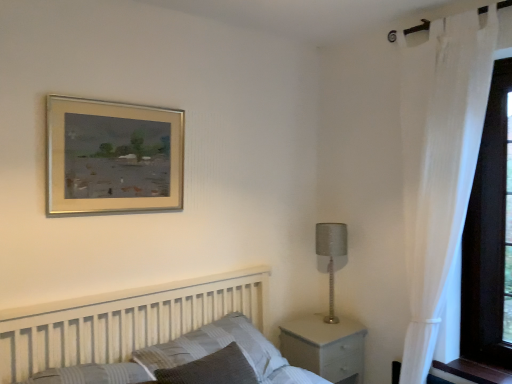
Where is `free space in front of satin silver lamp at right`? The height and width of the screenshot is (384, 512). free space in front of satin silver lamp at right is located at coordinates (331, 336).